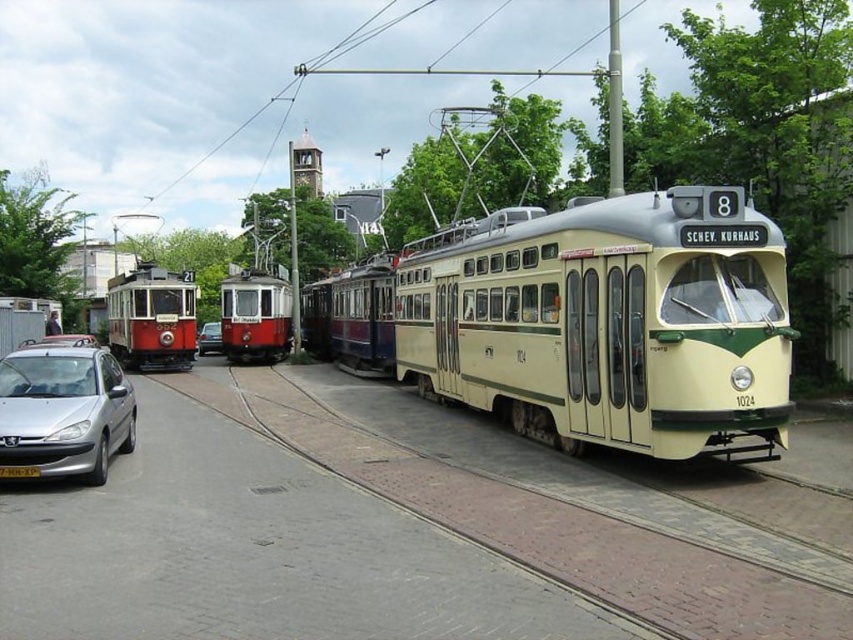
You are a delivery person who needs to load a package into a vehicle. You see a silver metallic hatchback at lower left and a metallic silver car at center. Which vehicle has more vertical space inside for tall items?

The metallic silver car at center is taller than the silver metallic hatchback at lower left, so it has more vertical space inside for tall items.

You are standing at the camera position and want to place a small flag at the closest point between point (x=84, y=369) and point (x=204, y=346). Which point should you choose?

Point (x=84, y=369) is closer to the camera than point (x=204, y=346), so you should choose point (x=84, y=369) to place the flag.

You are a pedestrian standing on the tram tracks and want to walk to the silver metallic hatchback at lower left. Which direction should you walk relative to the metallic silver car at center?

The silver metallic hatchback at lower left is to the right of the metallic silver car at center, so you should walk to the right of the metallic silver car at center to reach the silver metallic hatchback at lower left.